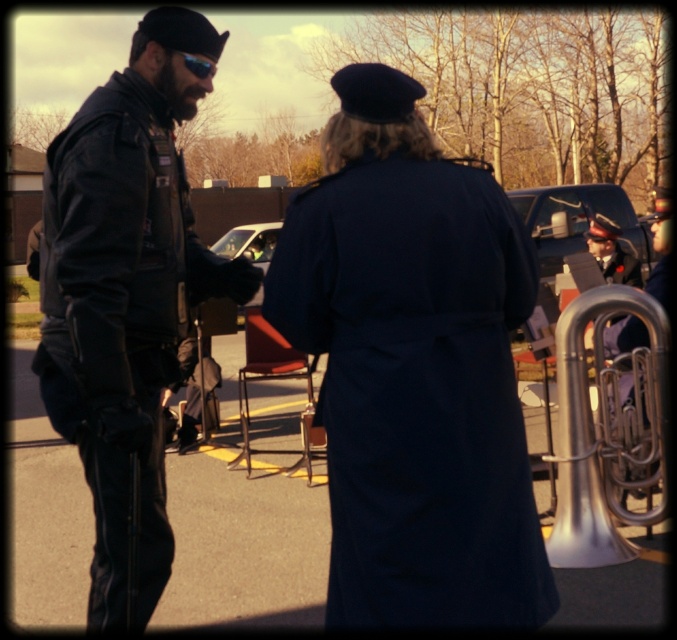
Question: Which object is closer to the camera taking this photo?

Choices:
 (A) navy wool coat at center
 (B) silver metallic tuba at lower right

Answer: (A)

Question: Does navy wool coat at center have a greater width compared to leather jacket at left?

Choices:
 (A) no
 (B) yes

Answer: (B)

Question: Is leather jacket at left bigger than silver metallic tuba at lower right?

Choices:
 (A) no
 (B) yes

Answer: (B)

Question: Which point is farther to the camera?

Choices:
 (A) (556, 484)
 (B) (395, 387)
 (C) (60, 268)

Answer: (A)

Question: Is navy wool coat at center behind silver metallic tuba at lower right?

Choices:
 (A) yes
 (B) no

Answer: (B)

Question: Which point is closer to the camera?

Choices:
 (A) (437, 340)
 (B) (657, 394)
 (C) (158, 24)

Answer: (A)